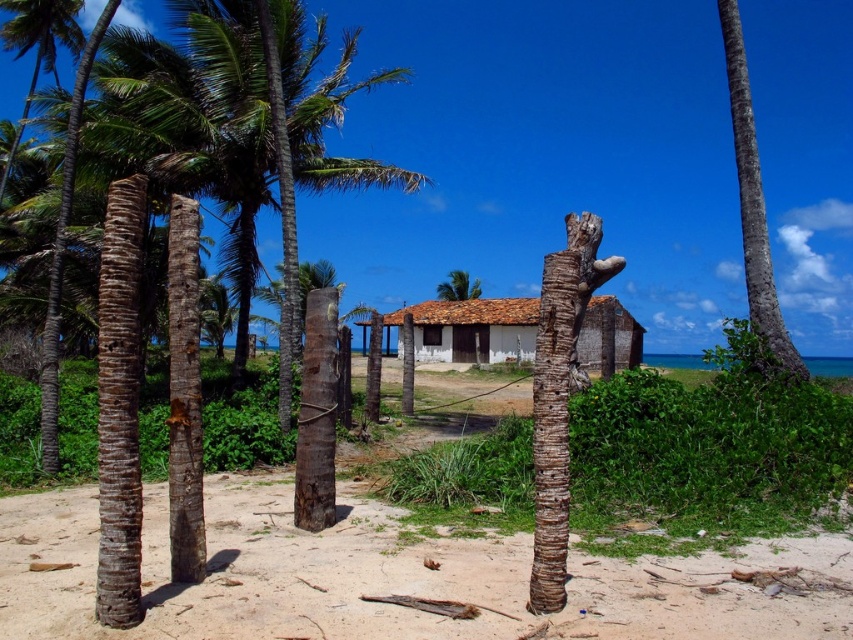
Which is above, brown sandy soil at center or brown rough bark tree at right?

brown rough bark tree at right is higher up.

Between brown sandy soil at center and brown rough bark tree at right, which one appears on the right side from the viewer's perspective?

brown rough bark tree at right is more to the right.

I want to click on brown sandy soil at center, so click(x=389, y=577).

At what (x,y) coordinates should I click in order to perform the action: click on brown sandy soil at center. Please return your answer as a coordinate pair (x, y). Looking at the image, I should click on (389, 577).

Is point (566, 403) less distant than point (589, 330)?

Yes, it is.

Looking at this image, does brown rough tree trunk at center appear under white wooden hut at center?

Indeed, brown rough tree trunk at center is positioned under white wooden hut at center.

Is point (547, 579) positioned behind point (466, 339)?

No, it is not.

This screenshot has height=640, width=853. I want to click on brown rough tree trunk at center, so click(560, 396).

In the scene shown: Between white wooden hut at center and brown rough bark tree at right, which one appears on the left side from the viewer's perspective?

white wooden hut at center

Does white wooden hut at center have a greater height compared to brown rough bark tree at right?

No, white wooden hut at center is not taller than brown rough bark tree at right.

Is point (444, 326) less distant than point (735, 108)?

No, (444, 326) is behind (735, 108).

This screenshot has width=853, height=640. Find the location of `white wooden hut at center`. white wooden hut at center is located at coordinates (468, 330).